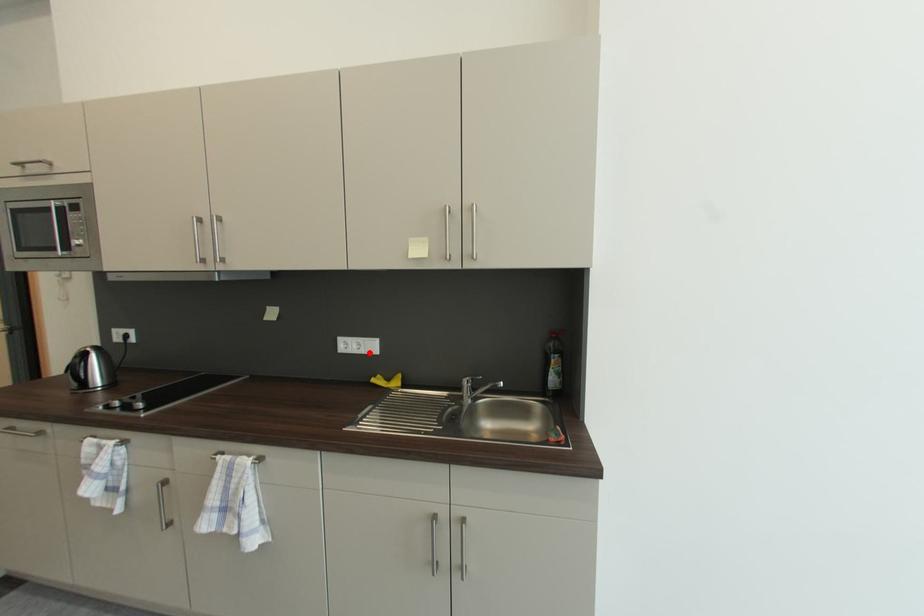
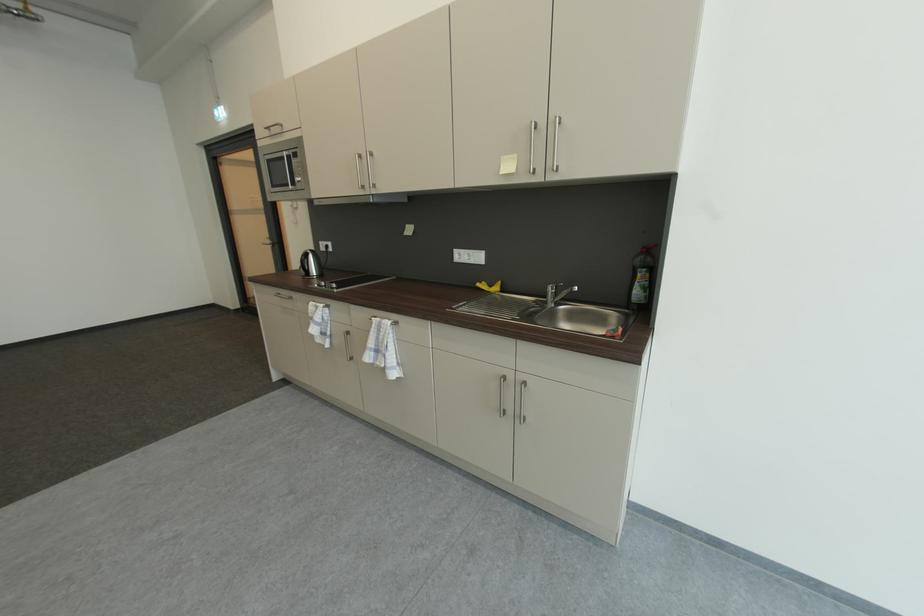
Where in the second image is the point corresponding to the highlighted location from the first image?

(479, 262)